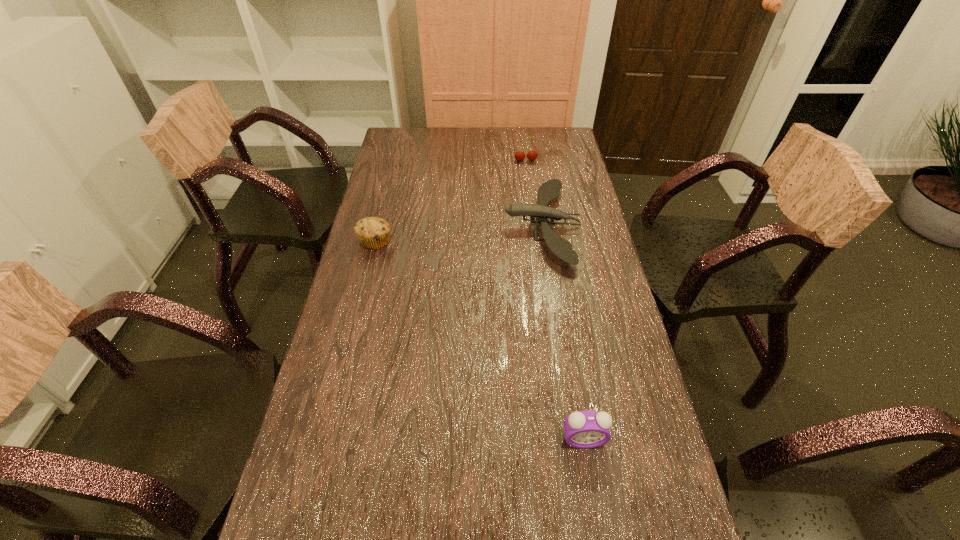
I want to click on object that is at the left edge, so click(373, 233).

Identify the location of alarm clock present at the right edge. Image resolution: width=960 pixels, height=540 pixels. (586, 429).

You are a GUI agent. You are given a task and a screenshot of the screen. Output one action in this format:
    pyautogui.click(x=<x>, y=<y>)
    Task: Click on the drone present at the right edge
    Image resolution: width=960 pixels, height=540 pixels.
    Given the screenshot: What is the action you would take?
    pyautogui.click(x=549, y=190)

Image resolution: width=960 pixels, height=540 pixels. I want to click on vacant space at the far edge of the desktop, so click(520, 132).

Find the location of a particular element. This screenshot has height=540, width=960. free spot at the left edge of the desktop is located at coordinates (381, 355).

Identify the location of free region at the right edge of the desktop. The height and width of the screenshot is (540, 960). (578, 168).

The height and width of the screenshot is (540, 960). Identify the location of vacant area at the far right corner. (554, 150).

Locate an element on the screen. The width and height of the screenshot is (960, 540). vacant space that is in between the muffin and the cherry is located at coordinates (450, 201).

The width and height of the screenshot is (960, 540). I want to click on free space between the drone and the farthest object, so click(534, 193).

The width and height of the screenshot is (960, 540). Identify the location of vacant space that's between the alarm clock and the drone. (563, 333).